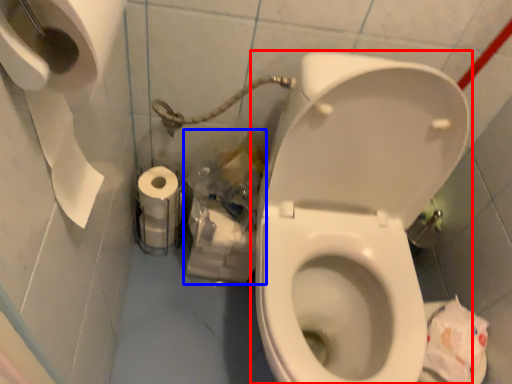
Question: Which object is closer to the camera taking this photo, toilet (highlighted by a red box) or garbage (highlighted by a blue box)?

Choices:
 (A) toilet
 (B) garbage

Answer: (A)